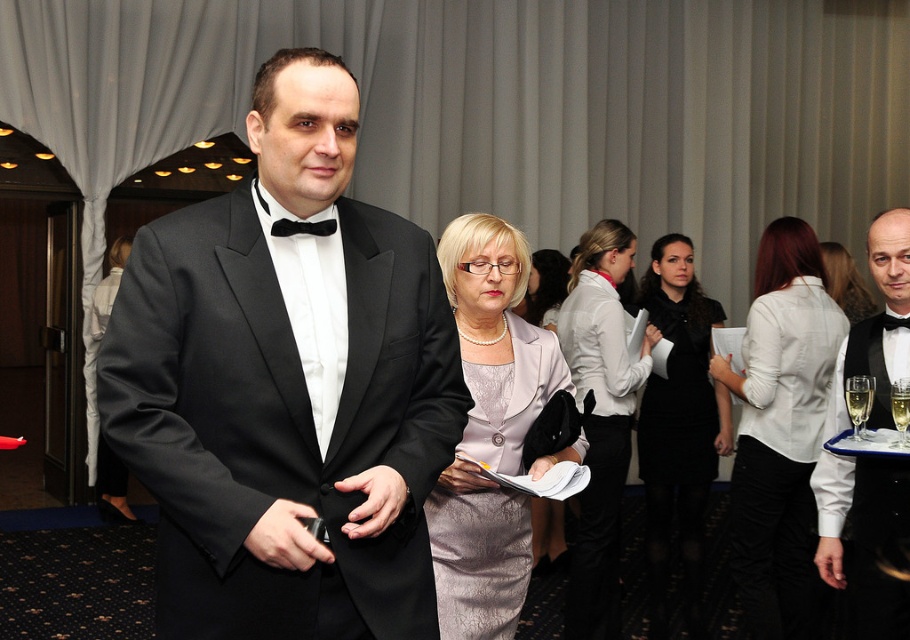
Question: Which point is farther to the camera?

Choices:
 (A) black satin dress at center
 (B) black satin bow tie at center

Answer: (A)

Question: Which object appears farthest from the camera in this image?

Choices:
 (A) satin gray dress at center
 (B) matte gray dress at center
 (C) black satin dress at center
 (D) black satin bow tie at upper right

Answer: (A)

Question: Considering the real-world distances, which object is closest to the black satin bow tie at upper right?

Choices:
 (A) black satin dress at center
 (B) satin gray dress at center
 (C) silvery satin dress at center

Answer: (C)

Question: Does black satin tuxedo at center come behind black satin dress at center?

Choices:
 (A) no
 (B) yes

Answer: (A)

Question: In this image, where is silvery satin dress at center located relative to black satin bow tie at center?

Choices:
 (A) right
 (B) left

Answer: (A)

Question: Is black satin tuxedo at center to the left of silvery satin dress at center from the viewer's perspective?

Choices:
 (A) yes
 (B) no

Answer: (A)